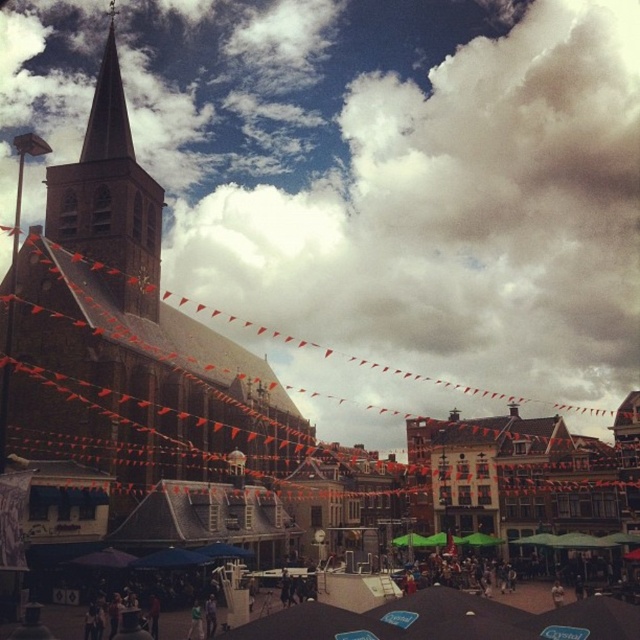
Between cloudy sky at upper center and brown stone steeple at upper left, which one appears on the right side from the viewer's perspective?

cloudy sky at upper center is more to the right.

Which is more to the left, cloudy sky at upper center or brown stone steeple at upper left?

Positioned to the left is brown stone steeple at upper left.

The width and height of the screenshot is (640, 640). Describe the element at coordinates (404, 179) in the screenshot. I see `cloudy sky at upper center` at that location.

At what (x,y) coordinates should I click in order to perform the action: click on cloudy sky at upper center. Please return your answer as a coordinate pair (x, y). This screenshot has width=640, height=640. Looking at the image, I should click on (404, 179).

Does brown stone church at center have a greater height compared to smooth gray steeple at upper left?

Yes.

Which is above, brown stone church at center or smooth gray steeple at upper left?

smooth gray steeple at upper left is above.

The height and width of the screenshot is (640, 640). What are the coordinates of `brown stone church at center` in the screenshot? It's located at (125, 336).

Between cloudy sky at upper center and brown stone church at center, which one has less height?

With less height is brown stone church at center.

Describe the element at coordinates (404, 179) in the screenshot. I see `cloudy sky at upper center` at that location.

Image resolution: width=640 pixels, height=640 pixels. I want to click on cloudy sky at upper center, so click(x=404, y=179).